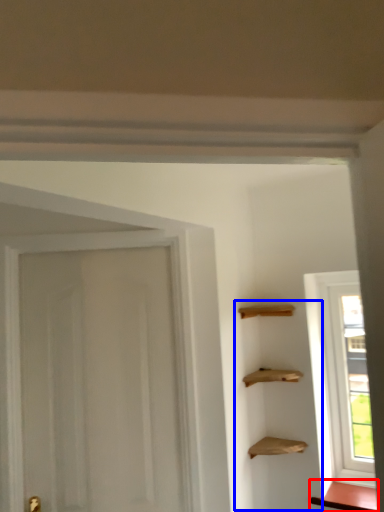
Question: Among these objects, which one is nearest to the camera, cabinetry (highlighted by a red box) or cabinetry (highlighted by a blue box)?

Choices:
 (A) cabinetry
 (B) cabinetry

Answer: (B)